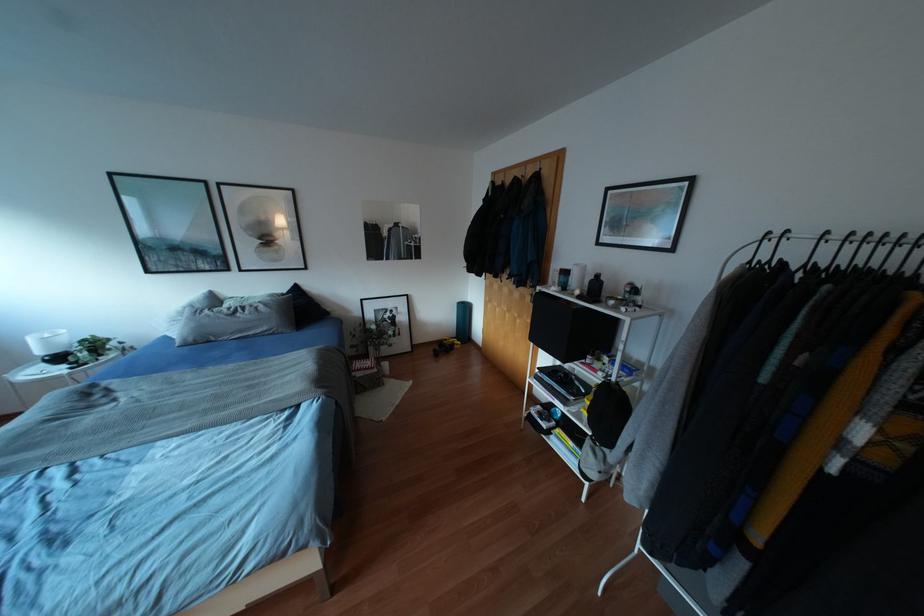
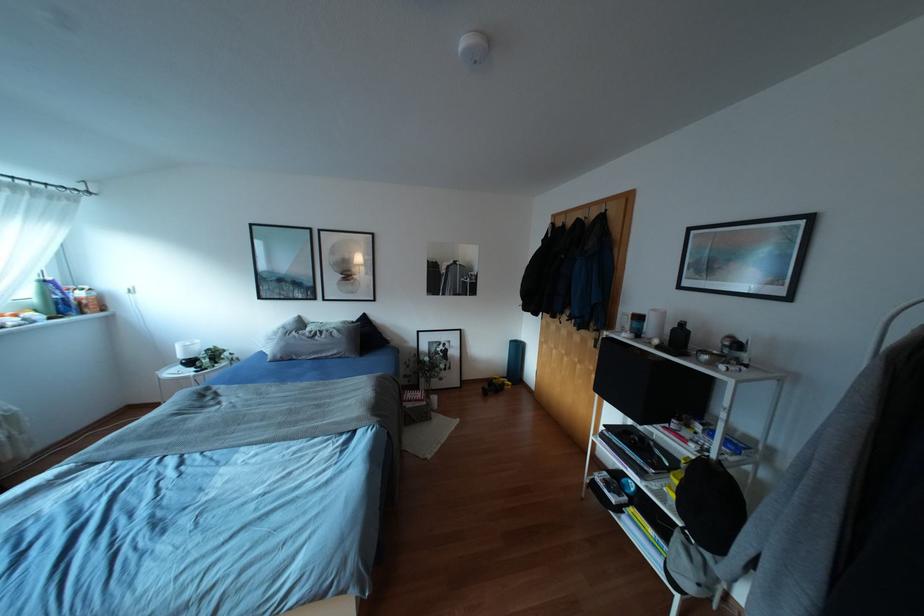
Find the pixel in the second image that matches point (296, 288) in the first image.

(363, 317)